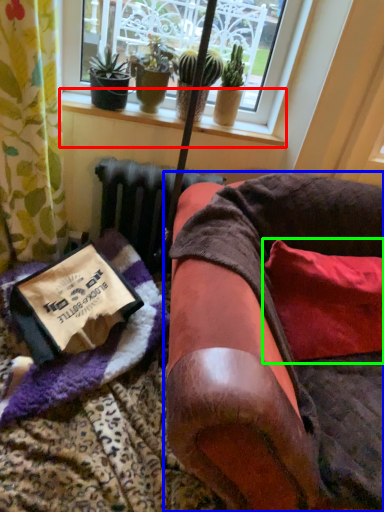
Question: Considering the real-world distances, which object is closest to window sill (highlighted by a red box)? furniture (highlighted by a blue box) or pillow (highlighted by a green box).

Choices:
 (A) furniture
 (B) pillow

Answer: (B)